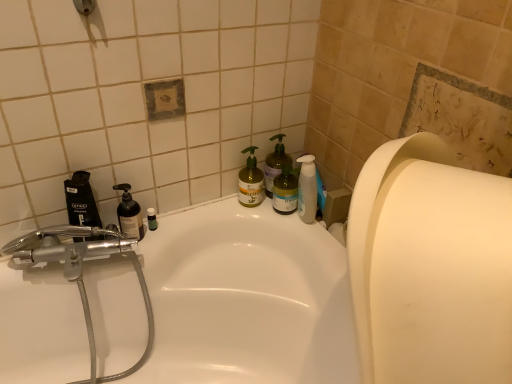
Question: Is black plastic mouthwash at left smaller than transparent plastic bottle at left?

Choices:
 (A) yes
 (B) no

Answer: (B)

Question: Can you confirm if black plastic mouthwash at left is bigger than transparent plastic bottle at left?

Choices:
 (A) no
 (B) yes

Answer: (B)

Question: From a real-world perspective, does black plastic mouthwash at left stand above transparent plastic bottle at left?

Choices:
 (A) yes
 (B) no

Answer: (A)

Question: From a real-world perspective, is black plastic mouthwash at left physically below transparent plastic bottle at left?

Choices:
 (A) yes
 (B) no

Answer: (B)

Question: Is the position of black plastic mouthwash at left more distant than that of transparent plastic bottle at left?

Choices:
 (A) no
 (B) yes

Answer: (A)

Question: Considering the relative sizes of black plastic mouthwash at left and transparent plastic bottle at left in the image provided, is black plastic mouthwash at left thinner than transparent plastic bottle at left?

Choices:
 (A) no
 (B) yes

Answer: (A)

Question: Does chrome metallic faucet at left have a smaller size compared to white glossy bathtub at center?

Choices:
 (A) no
 (B) yes

Answer: (B)

Question: Does chrome metallic faucet at left contain white glossy bathtub at center?

Choices:
 (A) yes
 (B) no

Answer: (B)

Question: Is chrome metallic faucet at left located outside white glossy bathtub at center?

Choices:
 (A) no
 (B) yes

Answer: (A)

Question: Is chrome metallic faucet at left at the right side of white glossy bathtub at center?

Choices:
 (A) no
 (B) yes

Answer: (A)

Question: From the image's perspective, is chrome metallic faucet at left under white glossy bathtub at center?

Choices:
 (A) yes
 (B) no

Answer: (B)

Question: Considering the relative positions of chrome metallic faucet at left and white glossy bathtub at center in the image provided, is chrome metallic faucet at left to the left of white glossy bathtub at center from the viewer's perspective?

Choices:
 (A) yes
 (B) no

Answer: (A)

Question: Is green matte bottle at center, the 2th cleaning product positioned from the left, positioned behind green matte pump bottle at upper right, positioned as the third cleaning product in left-to-right order?

Choices:
 (A) yes
 (B) no

Answer: (B)